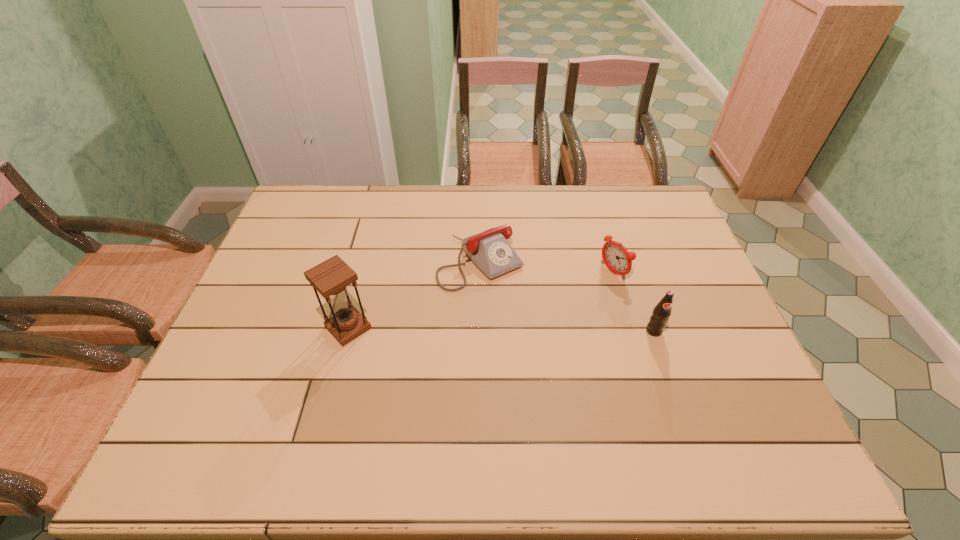
Locate an element on the screen. free space between the rightmost object and the alarm clock is located at coordinates (634, 301).

Choose which object is the third nearest neighbor to the second tallest object. Please provide its 2D coordinates. Your answer should be formatted as a tuple, i.e. [(x, y)], where the tuple contains the x and y coordinates of a point satisfying the conditions above.

[(330, 278)]

Identify which object is the second closest to the rightmost object. Please provide its 2D coordinates. Your answer should be formatted as a tuple, i.e. [(x, y)], where the tuple contains the x and y coordinates of a point satisfying the conditions above.

[(490, 251)]

Where is `free spot that satisfies the following two spatial constraints: 1. on the back side of the hourglass; 2. on the right side of the telephone`? The image size is (960, 540). free spot that satisfies the following two spatial constraints: 1. on the back side of the hourglass; 2. on the right side of the telephone is located at coordinates (366, 261).

At what (x,y) coordinates should I click in order to perform the action: click on free spot that satisfies the following two spatial constraints: 1. on the back side of the tallest object; 2. on the left side of the alarm clock. Please return your answer as a coordinate pair (x, y). The image size is (960, 540). Looking at the image, I should click on tap(363, 272).

The height and width of the screenshot is (540, 960). I want to click on vacant area that satisfies the following two spatial constraints: 1. on the back side of the third object from right to left; 2. on the right side of the tallest object, so click(x=366, y=261).

The width and height of the screenshot is (960, 540). Identify the location of vacant space that satisfies the following two spatial constraints: 1. on the front side of the shortest object; 2. on the right side of the third tallest object. (480, 272).